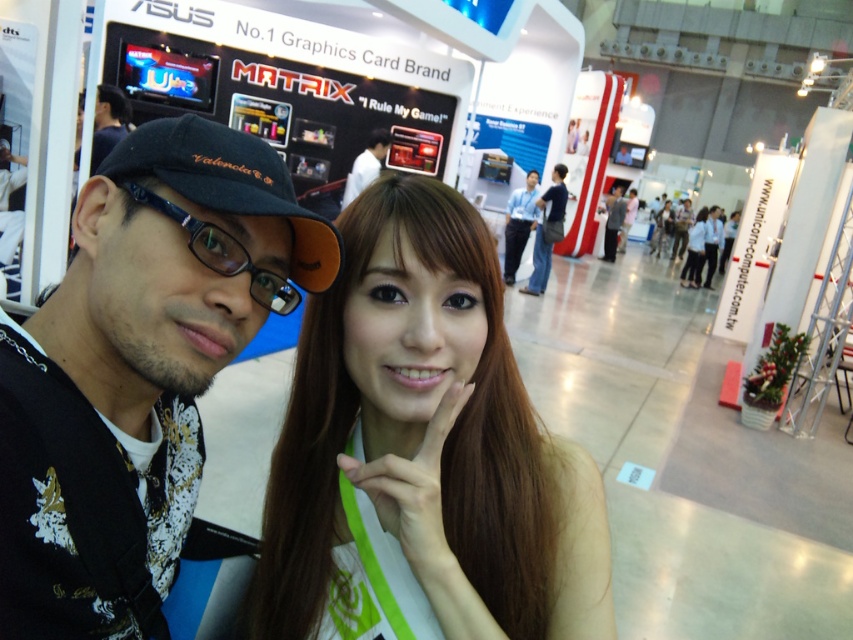
Who is positioned more to the left, black fabric baseball cap at center or matte black cap at upper left?

matte black cap at upper left is more to the left.

Who is more distant from viewer, (207, 150) or (372, 131)?

The point (372, 131) is more distant.

This screenshot has width=853, height=640. What are the coordinates of `black fabric baseball cap at center` in the screenshot? It's located at (228, 184).

Between blue shirt at center and matte black hair at center, which one appears on the right side from the viewer's perspective?

From the viewer's perspective, matte black hair at center appears more on the right side.

Can you confirm if blue shirt at center is positioned above matte black hair at center?

Actually, blue shirt at center is below matte black hair at center.

Locate an element on the screen. The width and height of the screenshot is (853, 640). blue shirt at center is located at coordinates (519, 224).

Looking at this image, does matte black cap at left have a greater height compared to matte black cap at upper left?

In fact, matte black cap at left may be shorter than matte black cap at upper left.

Is the position of matte black cap at left more distant than that of matte black cap at upper left?

No.

I want to click on matte black cap at left, so point(137,371).

In order to click on matte black cap at left in this screenshot , I will do click(x=137, y=371).